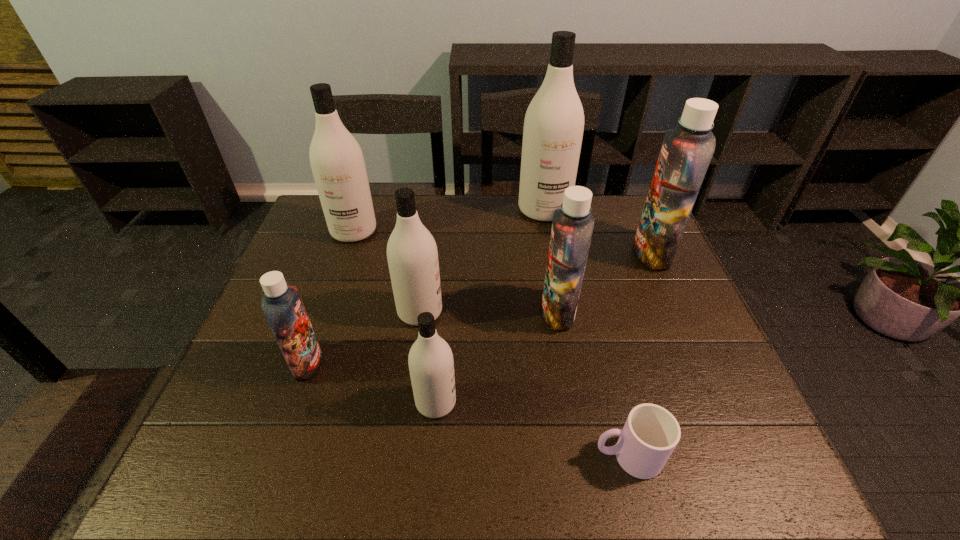
Locate an element on the screen. This screenshot has width=960, height=540. object that is at the far right corner is located at coordinates (686, 152).

At what (x,y) coordinates should I click in order to perform the action: click on free location at the far edge. Please return your answer as a coordinate pair (x, y). This screenshot has height=540, width=960. Looking at the image, I should click on (419, 212).

The width and height of the screenshot is (960, 540). I want to click on vacant region at the left edge of the desktop, so click(298, 242).

Find the location of a particular element. The width and height of the screenshot is (960, 540). free space at the right edge is located at coordinates click(x=668, y=310).

Locate an element on the screen. Image resolution: width=960 pixels, height=540 pixels. vacant region at the near left corner is located at coordinates point(259,446).

You are a GUI agent. You are given a task and a screenshot of the screen. Output one action in this format:
    pyautogui.click(x=<x>, y=<y>)
    Task: Click on the vacant space at the far right corner
    The height and width of the screenshot is (540, 960).
    Given the screenshot: What is the action you would take?
    pyautogui.click(x=611, y=217)

Locate an element on the screen. Image resolution: width=960 pixels, height=540 pixels. vacant space that's between the nearest object and the tallest shampoo is located at coordinates (586, 333).

Locate an element on the screen. The width and height of the screenshot is (960, 540). vacant space that is in between the rightmost object and the smallest white shampoo is located at coordinates (544, 327).

This screenshot has width=960, height=540. Find the location of `vacant space in between the third biggest white shampoo and the tallest shampoo`. vacant space in between the third biggest white shampoo and the tallest shampoo is located at coordinates (482, 261).

This screenshot has height=540, width=960. Identify the location of empty space that is in between the nearest white shampoo and the rightmost shampoo. (544, 327).